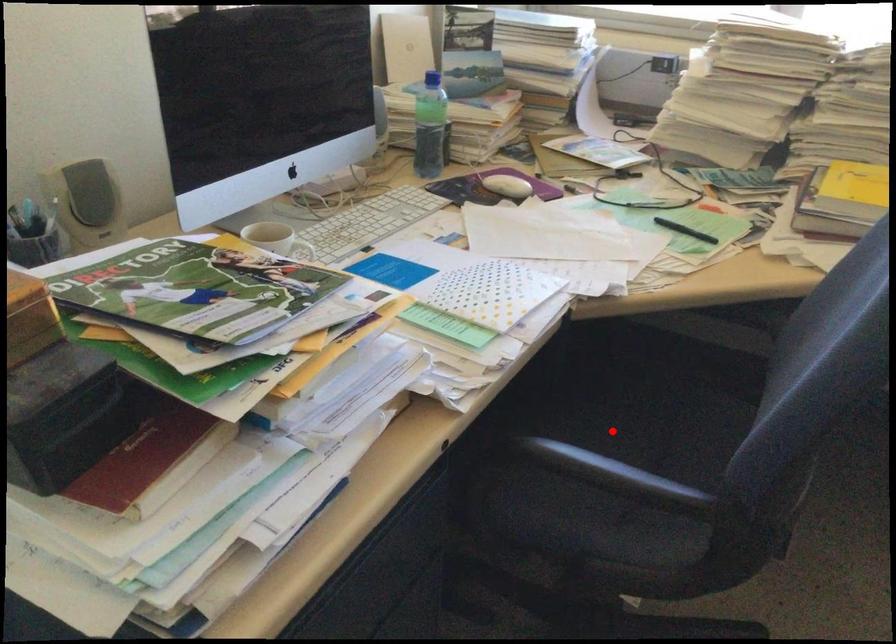
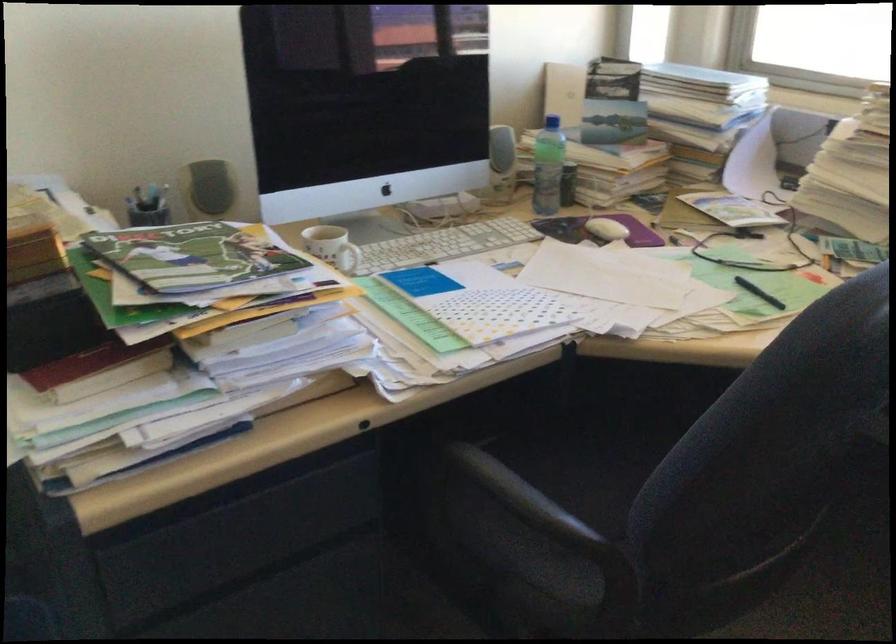
Where in the second image is the point corresponding to the highlighted location from the first image?

(616, 478)